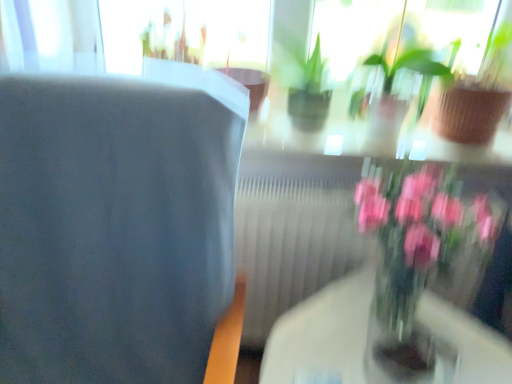
This screenshot has height=384, width=512. What are the coordinates of `empty space that is ontop of clear glass vase at center (from a real-world perspective)` in the screenshot? It's located at (379, 344).